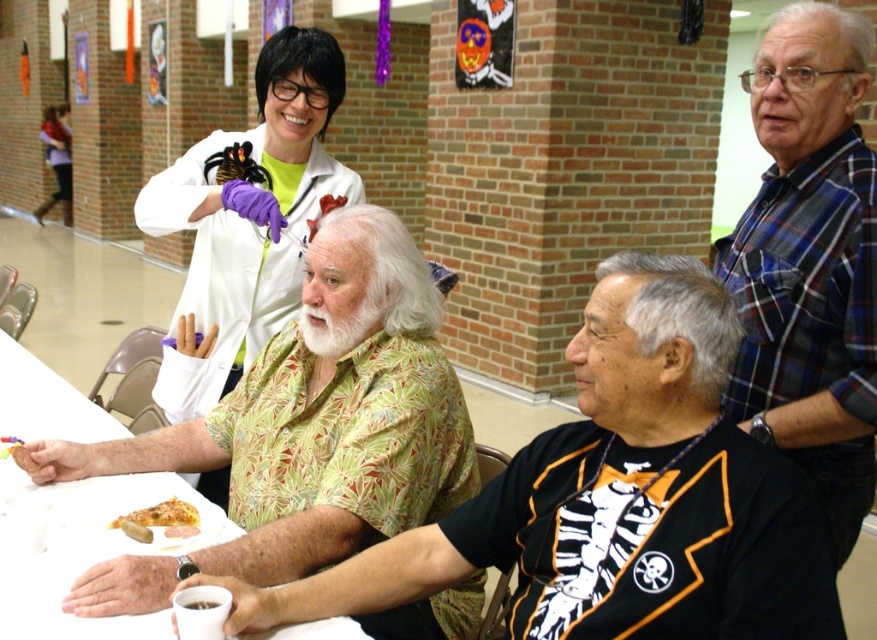
Looking at this image, you are at a Halloween party and need to grab the golden crispy pizza slice at lower left without touching the green leafy shirt at center. Is it possible?

The green leafy shirt at center is in front of the golden crispy pizza slice at lower left, so you cannot reach the pizza slice without moving the shirt first.

You are organizing a costume party and need to ensure all attendees have enough space in the cloakroom. The printed fabric shirt at center and the matte white lab coat at upper left are hanging side by side. Which garment will require more horizontal space due to its width?

The printed fabric shirt at center requires more horizontal space because its width is larger than the matte white lab coat at upper left.